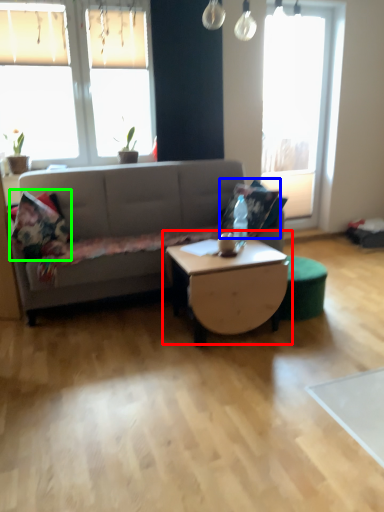
Question: Estimate the real-world distances between objects in this image. Which object is closer to coffee table (highlighted by a red box), pillow (highlighted by a blue box) or pillow (highlighted by a green box)?

Choices:
 (A) pillow
 (B) pillow

Answer: (A)